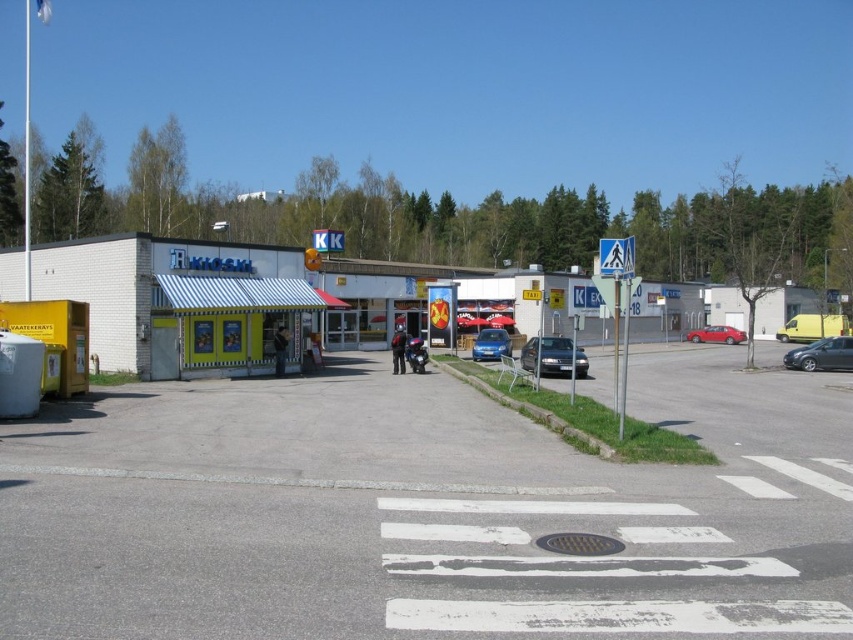
You are a pedestrian standing at the edge of the crosswalk. You need to reach the asphalt at center and the green striped awning at center. Which one is located to your right?

The asphalt at center is to the right of green striped awning at center, so the asphalt at center is located to your right.

You are taking a photo of the scene and want to focus on both point (160, 458) and point (561, 355). Which point should you focus on first to ensure both are in sharp focus?

You should focus on point (160, 458) first because it is closer to the camera than point (561, 355). This ensures the closer point is in focus, and the farther point will also be sharp due to depth of field.

You are a pedestrian standing at the edge of the crosswalk. You need to cross the road but want to avoid stepping on the satin black sedan at center. Where should you walk to stay on the asphalt at center?

The asphalt at center is below the satin black sedan at center, so to avoid stepping on the sedan, you should walk to the area under the satin black sedan at center where the asphalt at center is located.